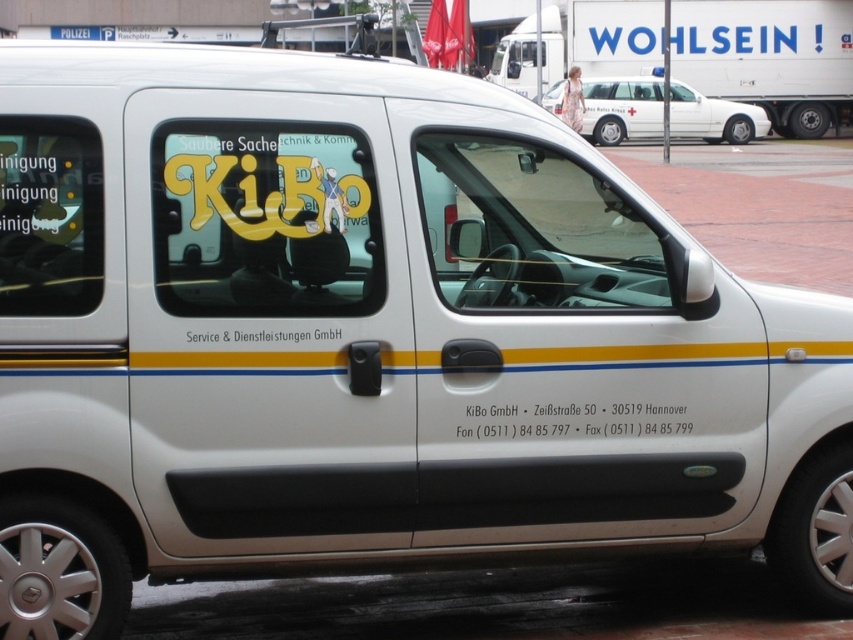
Please look at the image of the van. There is a point at coordinate (573,419). What is this point located on?

The point at coordinate (573,419) is located on the white matte text at lower center.

Consider the image. You are a delivery driver who needs to park your truck next to the white glossy car at upper center and the white matte text at lower center. Which object should you avoid parking too close to because of its height?

You should avoid parking too close to the white glossy car at upper center because it is taller than the white matte text at lower center.

You are standing at the scene shown in the image and want to reach the white glossy car at upper center. Given that the average walking speed is 1.4 meters per second, how many seconds will it take you to walk directly to the car?

The white glossy car at upper center is 33.56 meters from the viewer. At an average walking speed of 1.4 meters per second, it would take approximately 23.97 seconds to reach it. Rounding to the nearest whole number, it would take about 24 seconds.